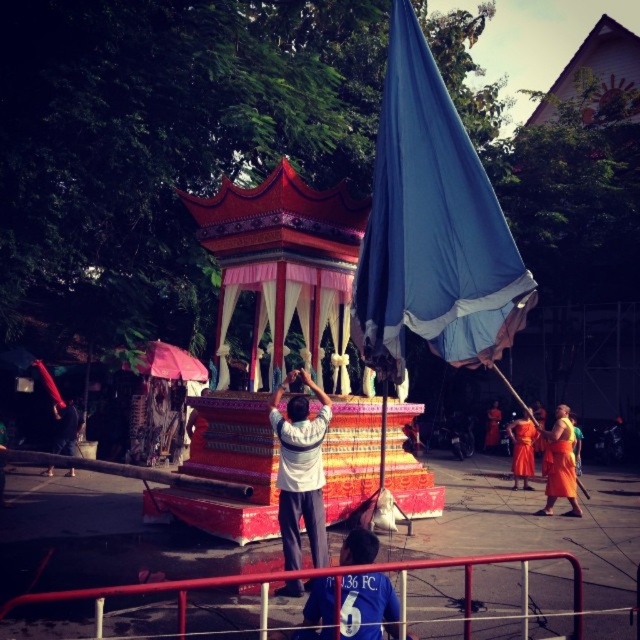
Based on the photo, you are standing at the center of the scene and want to place a new decoration between the two points, point(394, 20) and point(570, 500). Which point should the decoration be closer to in order to be in front of the other point?

The decoration should be closer to point(394, 20) because it is in front of point(570, 500).

You are a photographer at the event. You want to capture a photo that includes both the white matte shirt at center and the orange fabric person at center. Which one should you focus on first to ensure both are in frame?

The white matte shirt at center is above the orange fabric person at center, so focusing on the orange fabric person at center first would allow the camera to capture both in the frame as the shirt is positioned higher up.